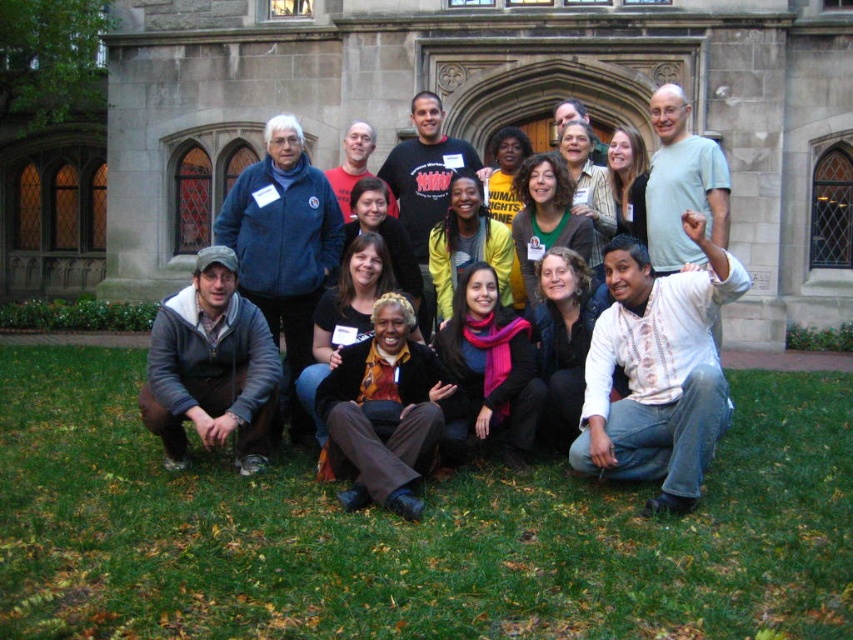
You are organizing a group photo and need to ensure that the participants are spaced appropriately. Considering the two individuals wearing the matte blue jacket at lower left and the yellow fabric shirt at center, which one requires more horizontal space between them and the person next to them?

The matte blue jacket at lower left requires more horizontal space between them and the person next to them because its width is larger than the yellow fabric shirt at center.